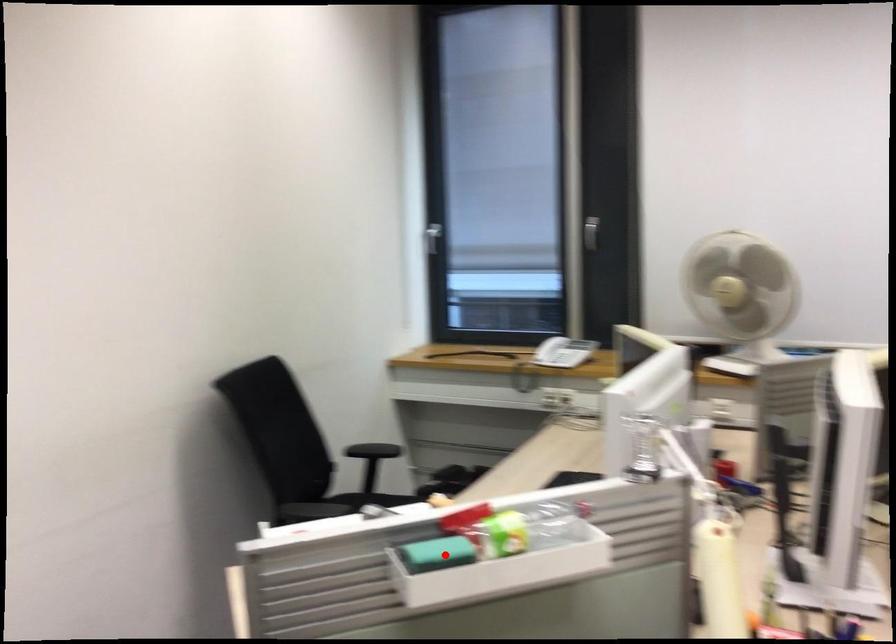
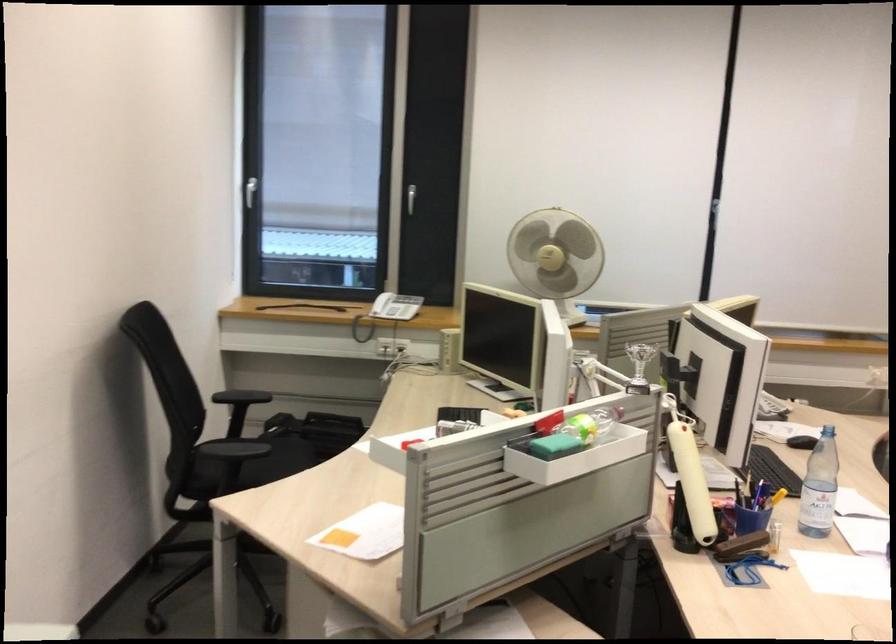
Locate, in the second image, the point that corresponds to the highlighted location in the first image.

(554, 446)